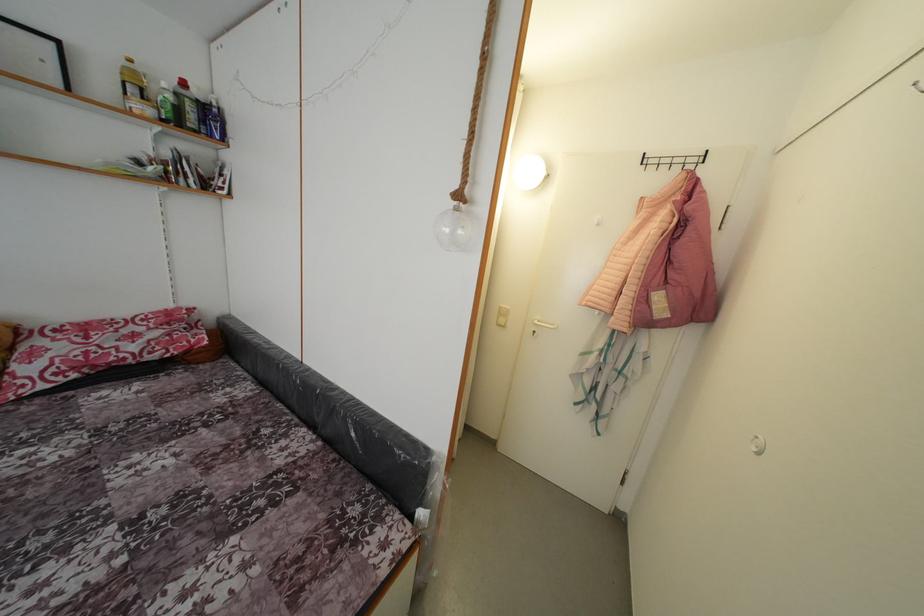
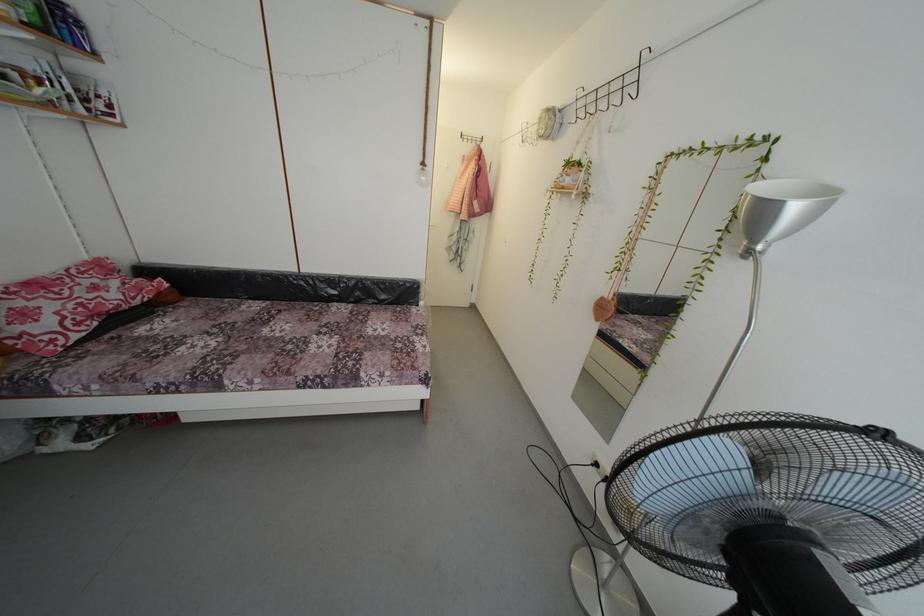
In the second image, find the point that corresponds to the point at 61,346 in the first image.

(34, 306)